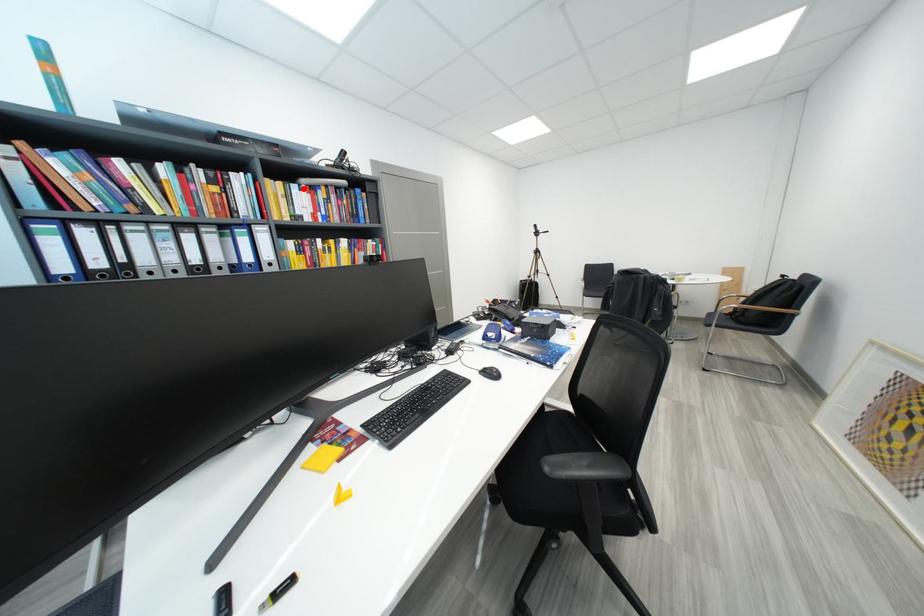
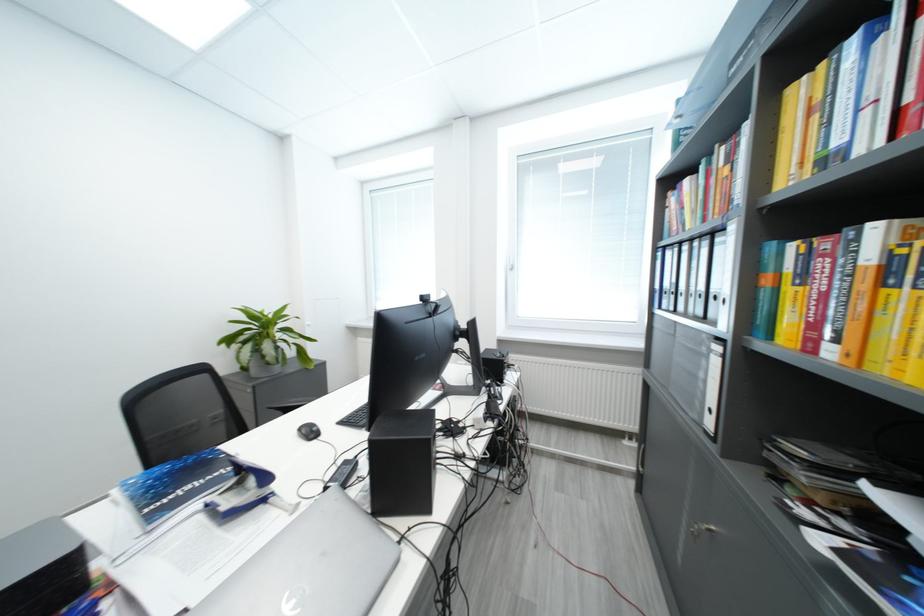
Where in the second image is the point corresponding to the highlighted location from the first image?

(861, 44)